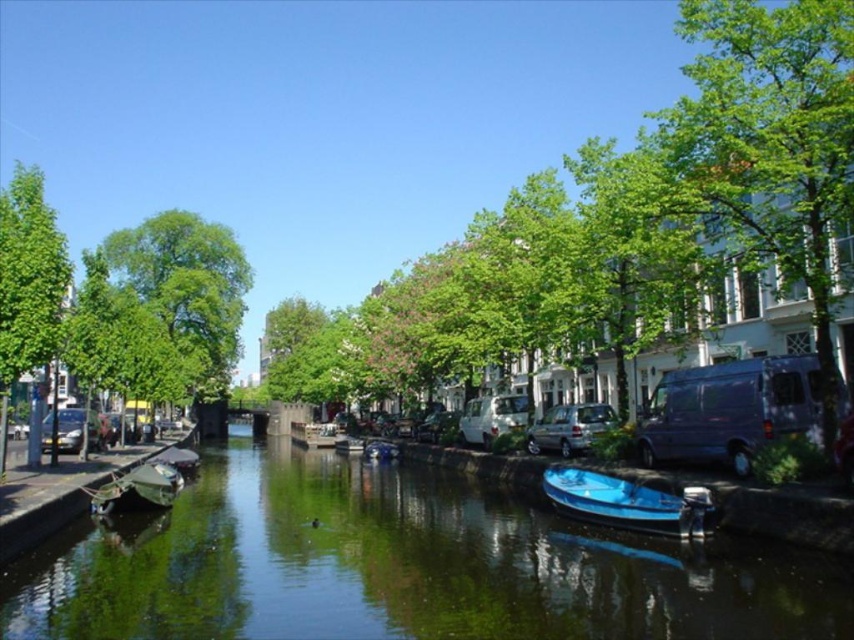
Question: Based on their relative distances, which object is farther from the green leafy tree at upper right?

Choices:
 (A) blue glossy boat at center
 (B) green leafy tree at center
 (C) green matte boat at center
 (D) green reflective water at center

Answer: (C)

Question: Among these objects, which one is nearest to the camera?

Choices:
 (A) blue glossy boat at center
 (B) green leafy tree at left
 (C) green leafy tree at center
 (D) green reflective water at center

Answer: (D)

Question: Is the position of green leafy tree at left more distant than that of blue glossy boat at center?

Choices:
 (A) yes
 (B) no

Answer: (A)

Question: Can you confirm if green leafy tree at upper right is smaller than green matte boat at center?

Choices:
 (A) yes
 (B) no

Answer: (B)

Question: Which of the following is the closest to the observer?

Choices:
 (A) blue glossy boat at center
 (B) green leafy tree at center
 (C) green leafy tree at upper right

Answer: (C)

Question: Is green reflective water at center thinner than blue glossy boat at center?

Choices:
 (A) yes
 (B) no

Answer: (B)